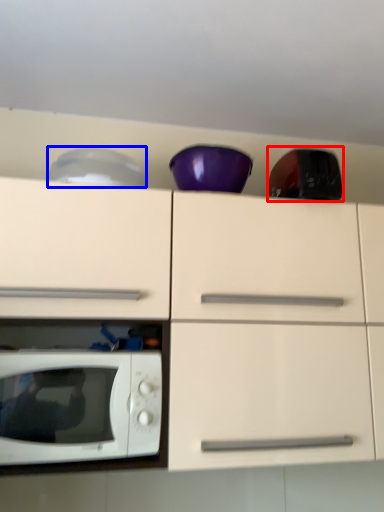
Question: Which object is further to the camera taking this photo, appliance (highlighted by a red box) or appliance (highlighted by a blue box)?

Choices:
 (A) appliance
 (B) appliance

Answer: (B)